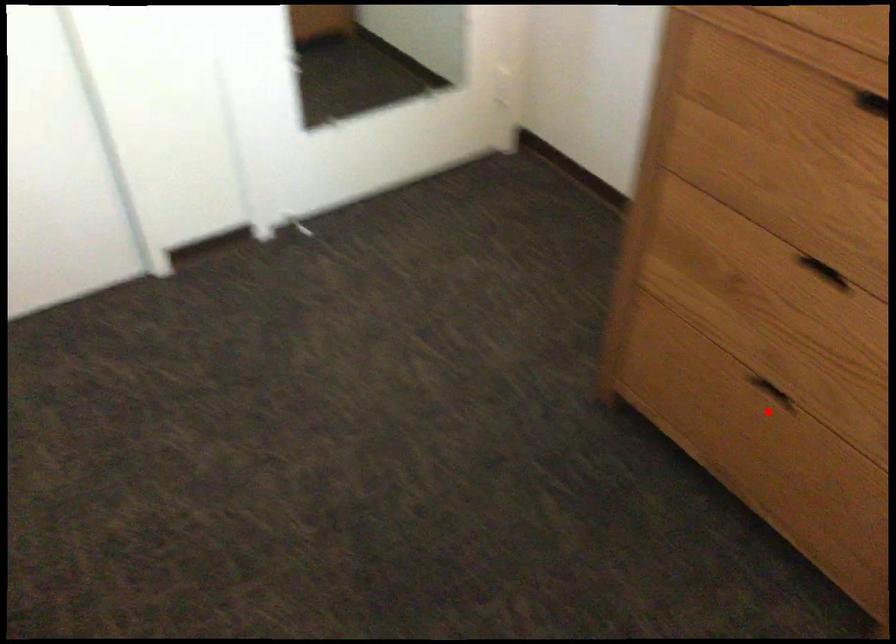
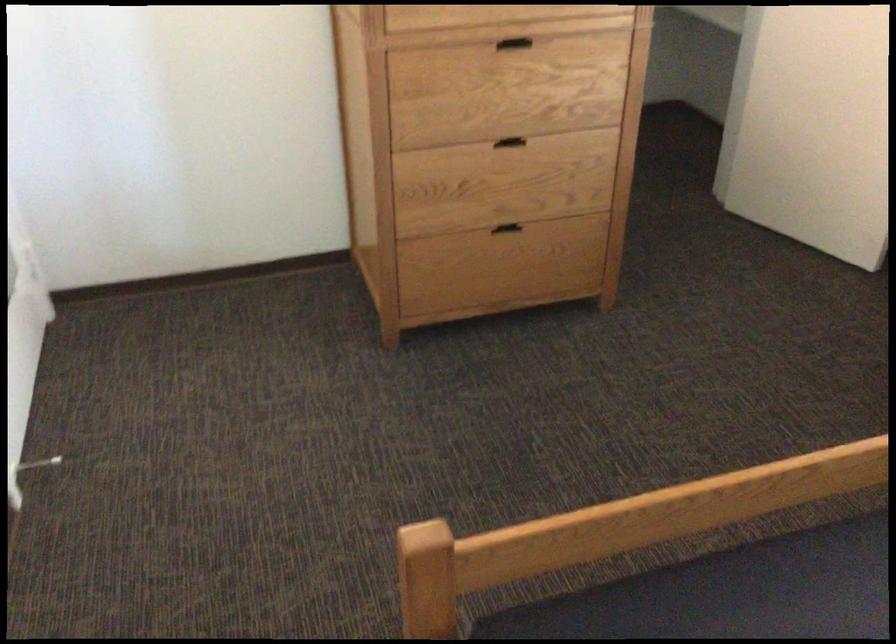
In the second image, find the point that corresponds to the highlighted location in the first image.

(510, 236)